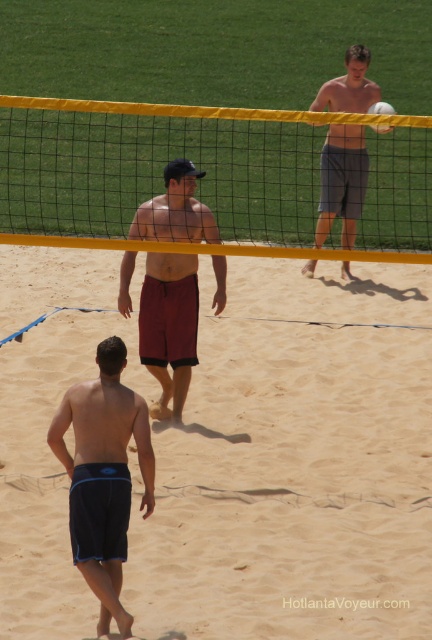
Is sandy beach at center bigger than matte red shorts at center?

Incorrect, sandy beach at center is not larger than matte red shorts at center.

Measure the distance between point (85,268) and camera.

The distance of point (85,268) from camera is 11.46 meters.

Find the location of `sandy beach at center`. sandy beach at center is located at coordinates point(294,465).

Can you confirm if sandy beach at center is smaller than gray cotton shorts at upper right?

Yes, sandy beach at center is smaller than gray cotton shorts at upper right.

Which is above, sandy beach at center or gray cotton shorts at upper right?

gray cotton shorts at upper right is higher up.

Which is behind, point (242, 604) or point (358, 218)?

Positioned behind is point (358, 218).

The image size is (432, 640). Find the location of `sandy beach at center`. sandy beach at center is located at coordinates (294, 465).

What do you see at coordinates (104, 476) in the screenshot? The image size is (432, 640). I see `dark blue shorts at center` at bounding box center [104, 476].

The width and height of the screenshot is (432, 640). What are the coordinates of `dark blue shorts at center` in the screenshot? It's located at (104, 476).